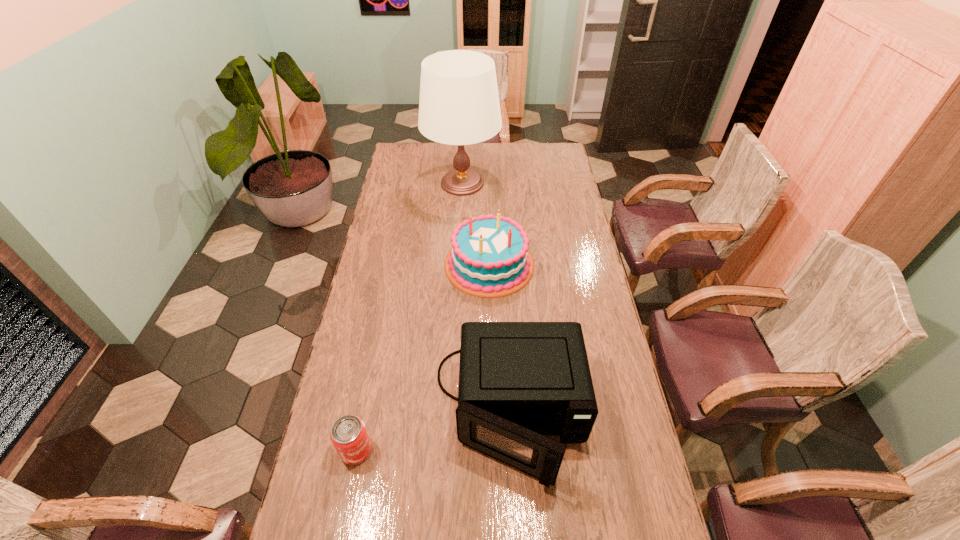
Identify the location of lamp. This screenshot has width=960, height=540. (459, 104).

Find the location of a particular element. The image size is (960, 540). the farthest object is located at coordinates (459, 104).

Locate an element on the screen. Image resolution: width=960 pixels, height=540 pixels. birthday cake is located at coordinates (489, 258).

The image size is (960, 540). I want to click on microwave oven, so click(518, 381).

Locate an element on the screen. can is located at coordinates (349, 436).

I want to click on the shortest object, so click(349, 436).

The height and width of the screenshot is (540, 960). I want to click on vacant region located on the back of the tallest object, so click(464, 144).

Find the location of a particular element. vacant space situated 0.180m on the right of the third nearest object is located at coordinates (579, 265).

The height and width of the screenshot is (540, 960). Identify the location of vacant point located on the back of the shortest object. (370, 380).

You are a GUI agent. You are given a task and a screenshot of the screen. Output one action in this format:
    pyautogui.click(x=<x>, y=<y>)
    Task: Click on the object located in the far edge section of the desktop
    The width and height of the screenshot is (960, 540).
    Given the screenshot: What is the action you would take?
    pyautogui.click(x=459, y=104)